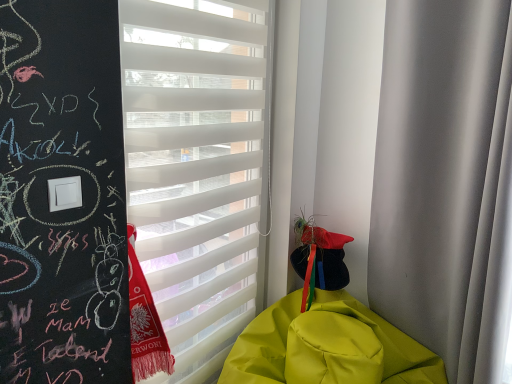
Question: Is white matte curtain at right facing towards white matte window blind at center?

Choices:
 (A) yes
 (B) no

Answer: (B)

Question: Is white matte curtain at right facing away from white matte window blind at center?

Choices:
 (A) no
 (B) yes

Answer: (A)

Question: Does white matte curtain at right appear on the right side of white matte window blind at center?

Choices:
 (A) yes
 (B) no

Answer: (A)

Question: Is white matte curtain at right completely or partially outside of white matte window blind at center?

Choices:
 (A) no
 (B) yes

Answer: (B)

Question: Is white matte curtain at right placed right next to white matte window blind at center?

Choices:
 (A) yes
 (B) no

Answer: (B)

Question: From the image's perspective, is white matte window blind at center located above or below yellow matte blanket at lower right?

Choices:
 (A) below
 (B) above

Answer: (B)

Question: Considering their positions, is white matte window blind at center located in front of or behind yellow matte blanket at lower right?

Choices:
 (A) behind
 (B) front

Answer: (A)

Question: Is point (183, 148) positioned closer to the camera than point (254, 322)?

Choices:
 (A) closer
 (B) farther

Answer: (A)

Question: In terms of height, does white matte window blind at center look taller or shorter compared to yellow matte blanket at lower right?

Choices:
 (A) short
 (B) tall

Answer: (B)

Question: Does point (356, 321) appear closer or farther from the camera than point (456, 18)?

Choices:
 (A) closer
 (B) farther

Answer: (B)

Question: Is yellow matte blanket at lower right in front of or behind white matte curtain at right in the image?

Choices:
 (A) front
 (B) behind

Answer: (A)

Question: From the image's perspective, is yellow matte blanket at lower right positioned above or below white matte curtain at right?

Choices:
 (A) above
 (B) below

Answer: (B)

Question: Is yellow matte blanket at lower right inside the boundaries of white matte curtain at right, or outside?

Choices:
 (A) outside
 (B) inside

Answer: (A)

Question: From a real-world perspective, is white matte curtain at right above or below yellow matte blanket at lower right?

Choices:
 (A) above
 (B) below

Answer: (A)

Question: Is point (408, 271) positioned closer to the camera than point (304, 347)?

Choices:
 (A) farther
 (B) closer

Answer: (A)